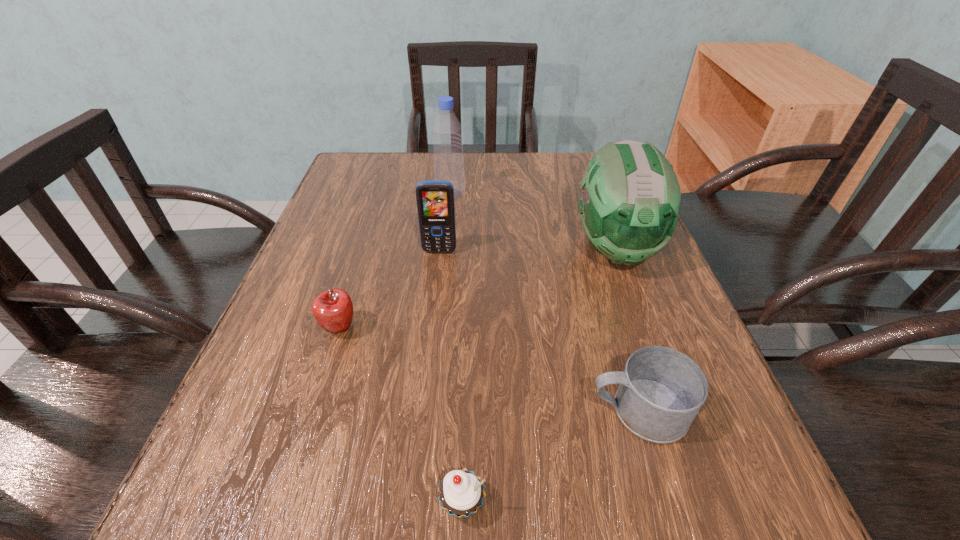
In order to click on vacant space at the far edge of the desktop in this screenshot , I will do `click(496, 159)`.

The height and width of the screenshot is (540, 960). I want to click on free space at the left edge of the desktop, so click(x=350, y=250).

Find the location of a particular element. The height and width of the screenshot is (540, 960). vacant area at the right edge of the desktop is located at coordinates (632, 298).

Find the location of `blank space at the far left corner of the desktop`. blank space at the far left corner of the desktop is located at coordinates coord(381,168).

In the image, there is a desktop. Where is `vacant space at the near left corner`? This screenshot has height=540, width=960. vacant space at the near left corner is located at coordinates (252, 491).

Locate an element on the screen. free space at the far right corner is located at coordinates (561, 179).

Where is `unoccupied position between the football helmet and the third tallest object`? The height and width of the screenshot is (540, 960). unoccupied position between the football helmet and the third tallest object is located at coordinates (527, 250).

Locate an element on the screen. vacant space that is in between the farthest object and the second nearest object is located at coordinates (544, 302).

Where is `free space that is in between the apple and the football helmet`? This screenshot has width=960, height=540. free space that is in between the apple and the football helmet is located at coordinates (478, 288).

The image size is (960, 540). Identify the location of unoccupied area between the cupcake and the cellular telephone. (451, 378).